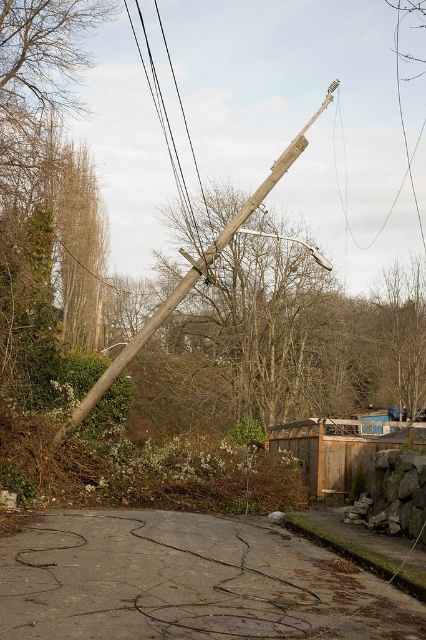
Can you confirm if brown wooden fence at center is bigger than wooden telegraph pole at center?

Incorrect, brown wooden fence at center is not larger than wooden telegraph pole at center.

Which is above, brown wooden fence at center or wooden telegraph pole at center?

wooden telegraph pole at center

The image size is (426, 640). What are the coordinates of `brown wooden fence at center` in the screenshot? It's located at (339, 448).

You are a GUI agent. You are given a task and a screenshot of the screen. Output one action in this format:
    pyautogui.click(x=<x>, y=<y>)
    Task: Click on the brown wooden fence at center
    
    Given the screenshot: What is the action you would take?
    pyautogui.click(x=339, y=448)

Can you confirm if wooden telegraph pole at center is wider than black wire at upper center?

Indeed, wooden telegraph pole at center has a greater width compared to black wire at upper center.

Between wooden telegraph pole at center and black wire at upper center, which one appears on the right side from the viewer's perspective?

wooden telegraph pole at center

Describe the element at coordinates (189, 276) in the screenshot. Image resolution: width=426 pixels, height=640 pixels. I see `wooden telegraph pole at center` at that location.

You are a GUI agent. You are given a task and a screenshot of the screen. Output one action in this format:
    pyautogui.click(x=<x>, y=<y>)
    Task: Click on the wooden telegraph pole at center
    The width and height of the screenshot is (426, 640).
    Given the screenshot: What is the action you would take?
    pyautogui.click(x=189, y=276)

Who is taller, brown wooden fence at center or black wire at upper center?

With more height is black wire at upper center.

Does brown wooden fence at center appear on the right side of black wire at upper center?

Indeed, brown wooden fence at center is positioned on the right side of black wire at upper center.

Is point (337, 429) behind point (127, 13)?

No, (337, 429) is in front of (127, 13).

Locate an element on the screen. The width and height of the screenshot is (426, 640). brown wooden fence at center is located at coordinates (339, 448).